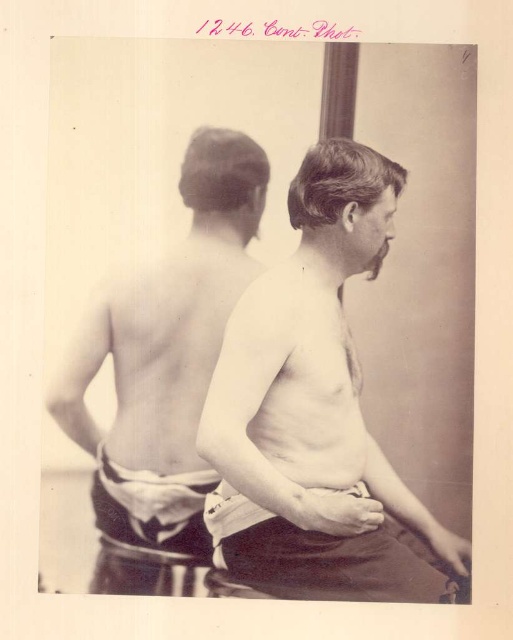
Question: Is smooth skin man at center closer to camera compared to white cotton underclothes at lower center?

Choices:
 (A) yes
 (B) no

Answer: (A)

Question: Which of the following is the farthest from the observer?

Choices:
 (A) white cotton underclothes at lower center
 (B) smooth skin torso at center

Answer: (A)

Question: Does smooth skin torso at center have a greater width compared to smooth skin man at center?

Choices:
 (A) yes
 (B) no

Answer: (A)

Question: Which object is closer to the camera taking this photo?

Choices:
 (A) smooth skin torso at center
 (B) white cotton underclothes at lower center

Answer: (A)

Question: Does smooth skin torso at center have a greater width compared to smooth skin man at center?

Choices:
 (A) yes
 (B) no

Answer: (A)

Question: Which of the following is the closest to the observer?

Choices:
 (A) (133, 480)
 (B) (344, 172)
 (C) (184, 348)

Answer: (A)